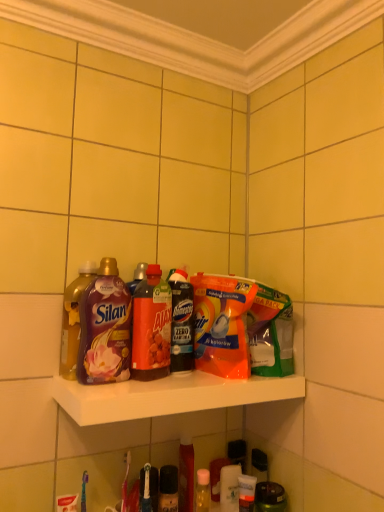
Question: Is translucent orange bottle at center, the 2th bottle when ordered from right to left, shorter than matte plastic bottle at left, the third bottle in the right-to-left sequence?

Choices:
 (A) no
 (B) yes

Answer: (B)

Question: Does translucent orange bottle at center, the 2th bottle when ordered from right to left, appear on the right side of matte plastic bottle at left, arranged as the 2th bottle when viewed from the left?

Choices:
 (A) no
 (B) yes

Answer: (B)

Question: Is translucent orange bottle at center, arranged as the third bottle when viewed from the left, touching matte plastic bottle at left, arranged as the 2th bottle when viewed from the left?

Choices:
 (A) yes
 (B) no

Answer: (A)

Question: Considering the relative sizes of translucent orange bottle at center, arranged as the third bottle when viewed from the left, and matte plastic bottle at left, the third bottle in the right-to-left sequence, in the image provided, is translucent orange bottle at center, arranged as the third bottle when viewed from the left, taller than matte plastic bottle at left, the third bottle in the right-to-left sequence,?

Choices:
 (A) yes
 (B) no

Answer: (B)

Question: From the image's perspective, would you say translucent orange bottle at center, the 2th bottle when ordered from right to left, is positioned over matte plastic bottle at left, the third bottle in the right-to-left sequence?

Choices:
 (A) no
 (B) yes

Answer: (A)

Question: From a real-world perspective, is shiny purple bottle at left, marked as the fourth bottle in a right-to-left arrangement, positioned above or below translucent orange bottle at center, arranged as the third bottle when viewed from the left?

Choices:
 (A) below
 (B) above

Answer: (A)

Question: From the image's perspective, is shiny purple bottle at left, marked as the fourth bottle in a right-to-left arrangement, positioned above or below translucent orange bottle at center, arranged as the third bottle when viewed from the left?

Choices:
 (A) below
 (B) above

Answer: (B)

Question: Is point (62, 343) positioned closer to the camera than point (144, 311)?

Choices:
 (A) farther
 (B) closer

Answer: (A)

Question: Considering their positions, is shiny purple bottle at left, acting as the 1th bottle starting from the left, located in front of or behind translucent orange bottle at center, arranged as the third bottle when viewed from the left?

Choices:
 (A) front
 (B) behind

Answer: (A)

Question: Considering the positions of white glossy shelf at center and translucent plastic bottle at center, which is the fourth bottle from left to right, in the image, is white glossy shelf at center wider or thinner than translucent plastic bottle at center, which is the fourth bottle from left to right,?

Choices:
 (A) wide
 (B) thin

Answer: (A)

Question: From a real-world perspective, is white glossy shelf at center positioned above or below translucent plastic bottle at center, which is the first bottle in right-to-left order?

Choices:
 (A) below
 (B) above

Answer: (A)

Question: Would you say white glossy shelf at center is to the left or to the right of translucent plastic bottle at center, which is the first bottle in right-to-left order, in the picture?

Choices:
 (A) right
 (B) left

Answer: (A)

Question: Looking at the image, does white glossy shelf at center seem bigger or smaller compared to translucent plastic bottle at center, which is the first bottle in right-to-left order?

Choices:
 (A) small
 (B) big

Answer: (B)

Question: Considering the positions of orange plastic dishwashing liquid at center and translucent plastic bottle at center, which is the fourth bottle from left to right, in the image, is orange plastic dishwashing liquid at center wider or thinner than translucent plastic bottle at center, which is the fourth bottle from left to right,?

Choices:
 (A) thin
 (B) wide

Answer: (B)

Question: In the image, is orange plastic dishwashing liquid at center positioned in front of or behind translucent plastic bottle at center, which is the first bottle in right-to-left order?

Choices:
 (A) front
 (B) behind

Answer: (A)